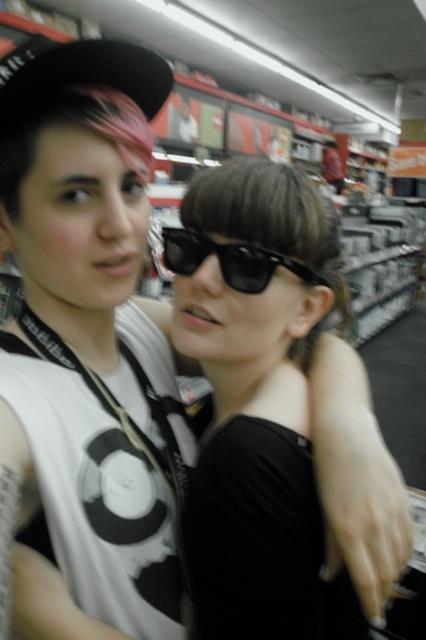
From the picture: You are a customer in a retail store and you want to buy the black matte sunglasses at center. Where should you look to find them?

The black matte sunglasses at center are located at point (271, 396).

Based on the photo, you are a store employee who needs to restock the black matte dress at center. The store policy requires that you maintain a minimum distance of 18 inches between customers for social distancing. Are the two people in the image positioned in a way that violates this policy?

The two individuals are 17.62 inches apart, which is less than the required 18 inches, so they are violating the store policy.

You are standing in a retail store aisle and want to pick up an item located at point [293,525]. You have a reach of 18 inches. Can you reach the item without moving closer?

The point [293,525] is 18.29 inches away from you, so you cannot reach it with your 18 inch reach. You need to move closer.